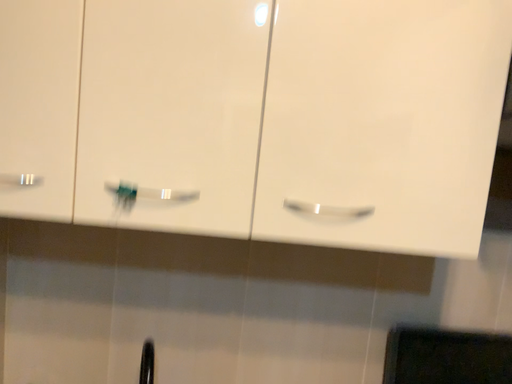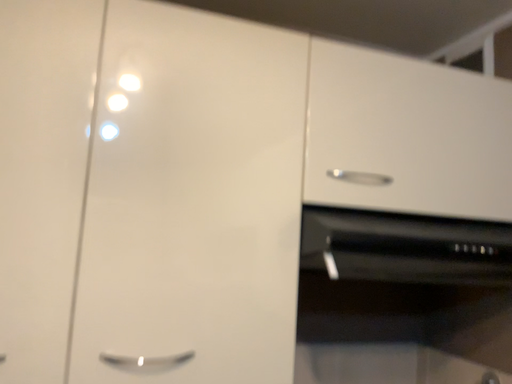
Question: Which way did the camera rotate in the video?

Choices:
 (A) rotated downward
 (B) rotated upward

Answer: (B)